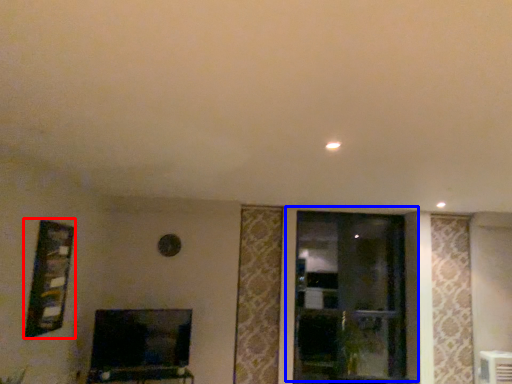
Question: Among these objects, which one is nearest to the camera, picture frame (highlighted by a red box) or window (highlighted by a blue box)?

Choices:
 (A) picture frame
 (B) window

Answer: (A)